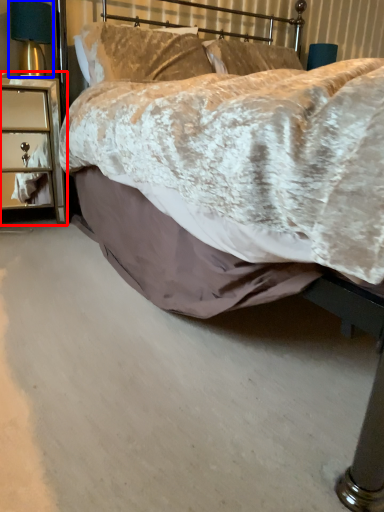
Question: Which of the following is the closest to the observer, nightstand (highlighted by a red box) or bedside lamp (highlighted by a blue box)?

Choices:
 (A) nightstand
 (B) bedside lamp

Answer: (A)